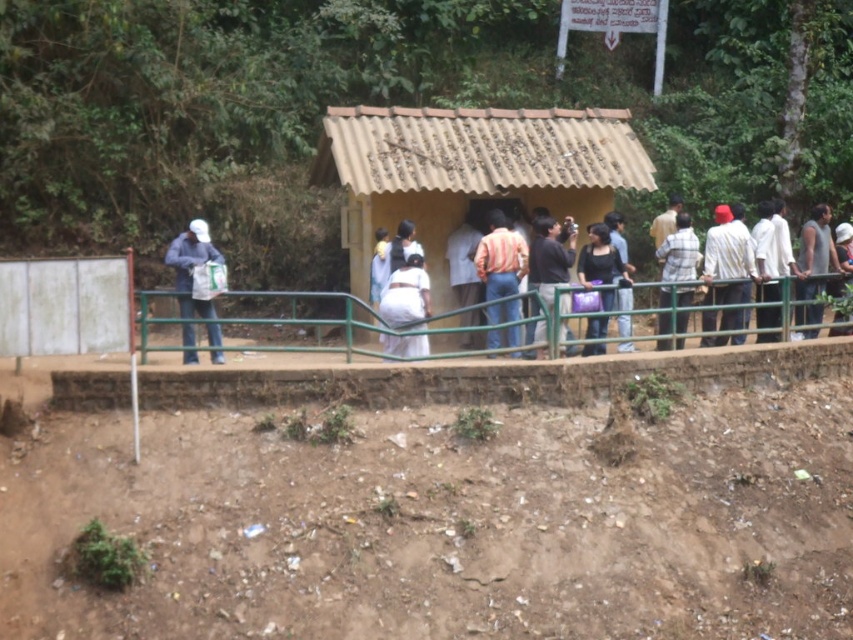
Question: Based on their relative distances, which object is farther from the striped cotton shirt at center?

Choices:
 (A) white cotton dress at center
 (B) green metal railing at center
 (C) plaid fabric shirt at center
 (D) matte black shirt at center

Answer: (A)

Question: Which object appears farthest from the camera in this image?

Choices:
 (A) dark brown hair at right
 (B) white cotton shirt at right
 (C) matte black shirt at center
 (D) white cloth at center

Answer: (A)

Question: Which object appears farthest from the camera in this image?

Choices:
 (A) dark brown hair at right
 (B) brown dirt track at lower center
 (C) matte blue jacket at left
 (D) plaid fabric shirt at center

Answer: (A)

Question: Is the position of black matte shirt at center more distant than that of matte black shirt at center?

Choices:
 (A) yes
 (B) no

Answer: (B)

Question: Does brown dirt track at lower center have a larger size compared to white cloth at center?

Choices:
 (A) yes
 (B) no

Answer: (B)

Question: From the image, what is the correct spatial relationship of brown corrugated roof hut at center in relation to matte blue jacket at left?

Choices:
 (A) right
 (B) left

Answer: (A)